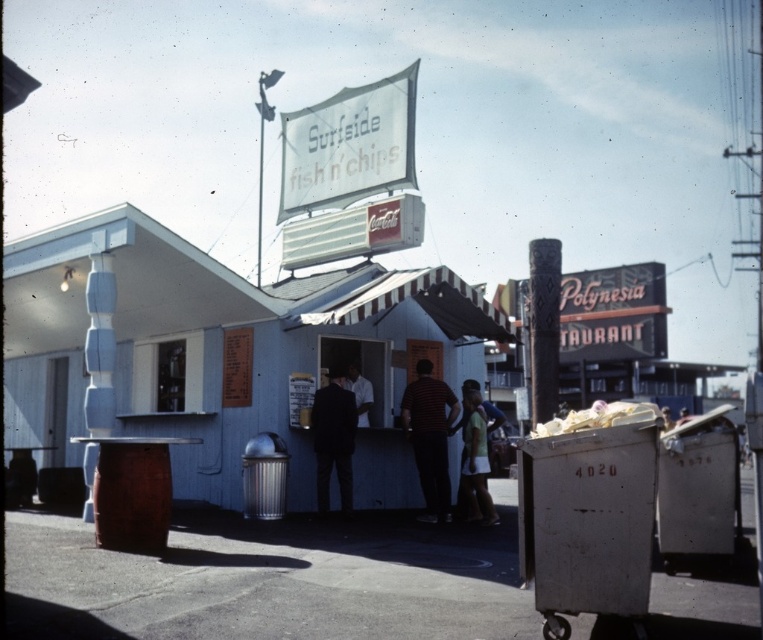
From the picture: Which is below, striped shirt at center or white matte shirt at center?

striped shirt at center

Does point (438, 515) come farther from viewer compared to point (361, 376)?

That is False.

Who is more forward, (446, 499) or (359, 406)?

Point (446, 499)

The image size is (763, 640). Identify the location of striped shirt at center. (430, 436).

Does dark blue suit at center have a greater height compared to white matte shirt at center?

Yes, dark blue suit at center is taller than white matte shirt at center.

Does dark blue suit at center have a greater width compared to white matte shirt at center?

Yes.

Who is more forward, (327,449) or (365,394)?

Point (327,449)

Identify the location of dark blue suit at center. The width and height of the screenshot is (763, 640). (333, 438).

Between striped shirt at center and dark blue suit at center, which one has less height?

dark blue suit at center

Does striped shirt at center have a lesser width compared to dark blue suit at center?

No.

Between point (419, 426) and point (330, 397), which one is positioned in front?

Point (330, 397)

The image size is (763, 640). I want to click on striped shirt at center, so click(430, 436).